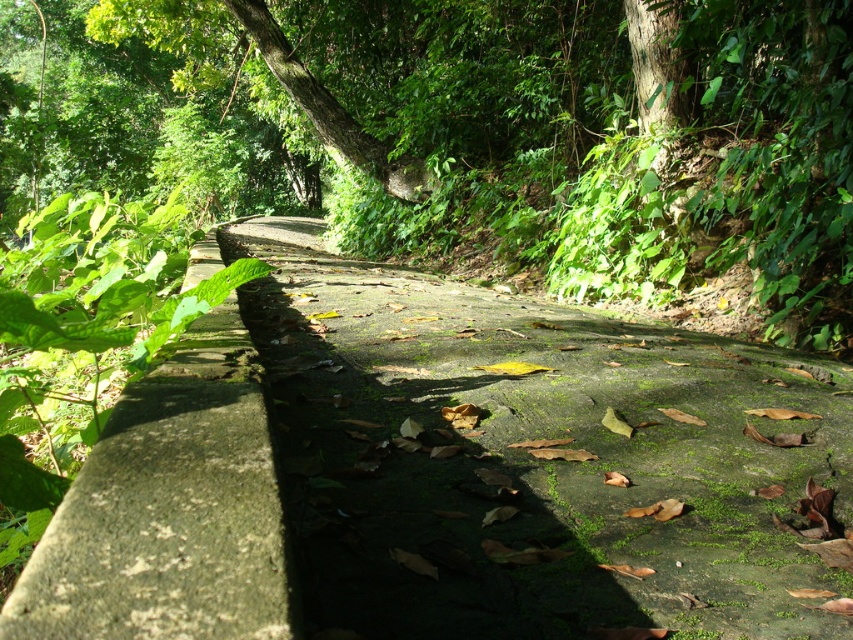
Who is higher up, green mossy concrete trail at center or green mossy stone at left?

Positioned higher is green mossy stone at left.

Is green mossy concrete trail at center taller than green mossy stone at left?

Yes, green mossy concrete trail at center is taller than green mossy stone at left.

Between point (424, 332) and point (184, 397), which one is positioned in front?

Point (184, 397) is more forward.

At what (x,y) coordinates should I click in order to perform the action: click on green mossy concrete trail at center. Please return your answer as a coordinate pair (x, y). The height and width of the screenshot is (640, 853). Looking at the image, I should click on (531, 460).